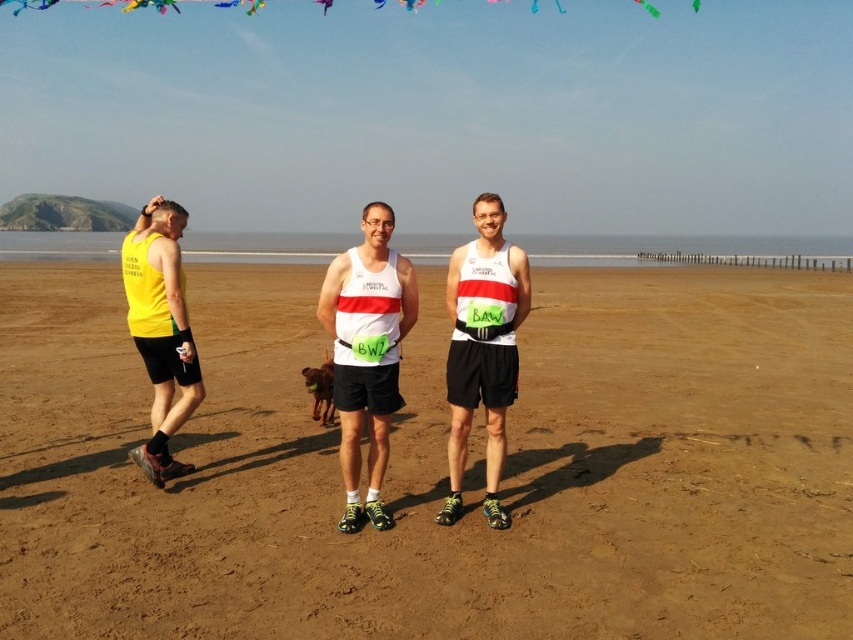
Question: Among these objects, which one is nearest to the camera?

Choices:
 (A) yellow fabric tank top at left
 (B) brown sandy beach at center
 (C) white matte singlet at center
 (D) matte black singlet at center

Answer: (B)

Question: Is white matte singlet at center positioned before yellow fabric tank top at left?

Choices:
 (A) no
 (B) yes

Answer: (B)

Question: Can you confirm if brown sandy beach at center is bigger than yellow fabric tank top at left?

Choices:
 (A) yes
 (B) no

Answer: (A)

Question: Which point is farther from the camera taking this photo?

Choices:
 (A) (167, 525)
 (B) (164, 400)

Answer: (B)

Question: Which point is closer to the camera?

Choices:
 (A) brown sandy beach at center
 (B) matte black singlet at center

Answer: (A)

Question: Where is brown sandy beach at center located in relation to yellow fabric tank top at left in the image?

Choices:
 (A) left
 (B) right

Answer: (A)